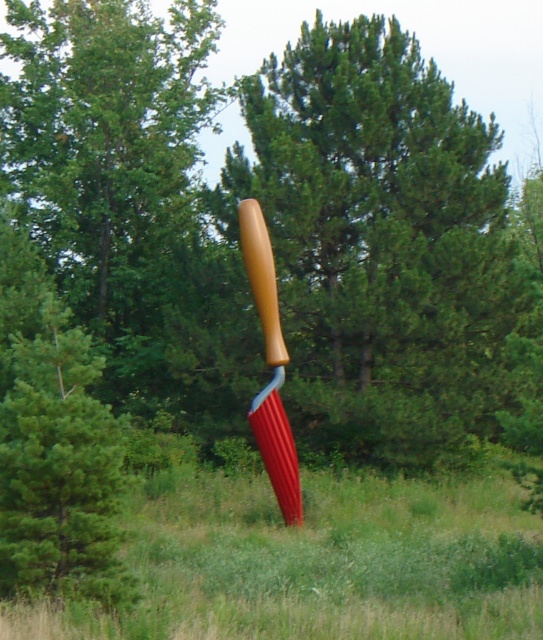
Can you confirm if smooth brown handle at center is positioned to the left of wooden handle baseball bat at center?

In fact, smooth brown handle at center is to the right of wooden handle baseball bat at center.

Does smooth brown handle at center have a greater height compared to wooden handle baseball bat at center?

Indeed, smooth brown handle at center has a greater height compared to wooden handle baseball bat at center.

Is point (416, 168) closer to camera compared to point (251, 280)?

That is False.

At what (x,y) coordinates should I click in order to perform the action: click on smooth brown handle at center. Please return your answer as a coordinate pair (x, y). Image resolution: width=543 pixels, height=640 pixels. Looking at the image, I should click on (377, 241).